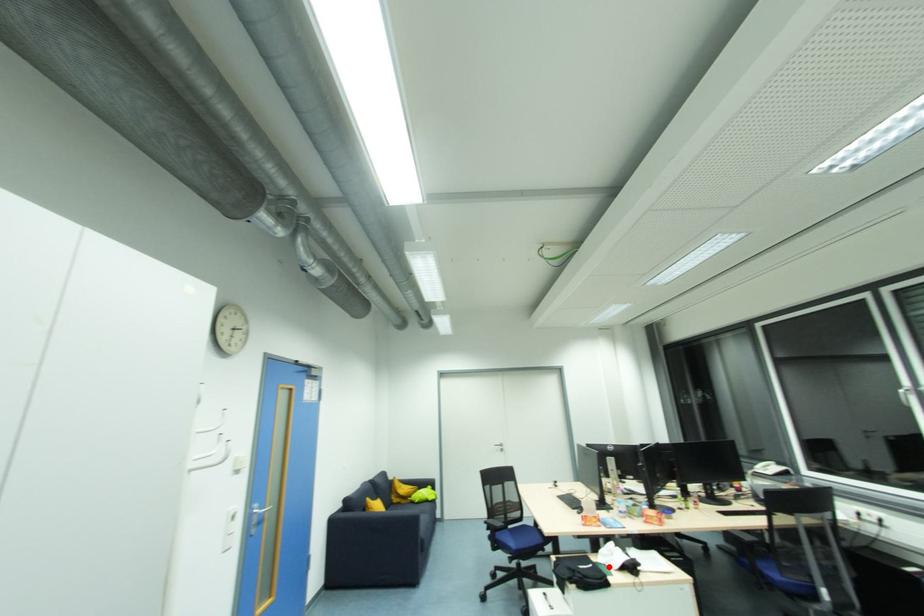
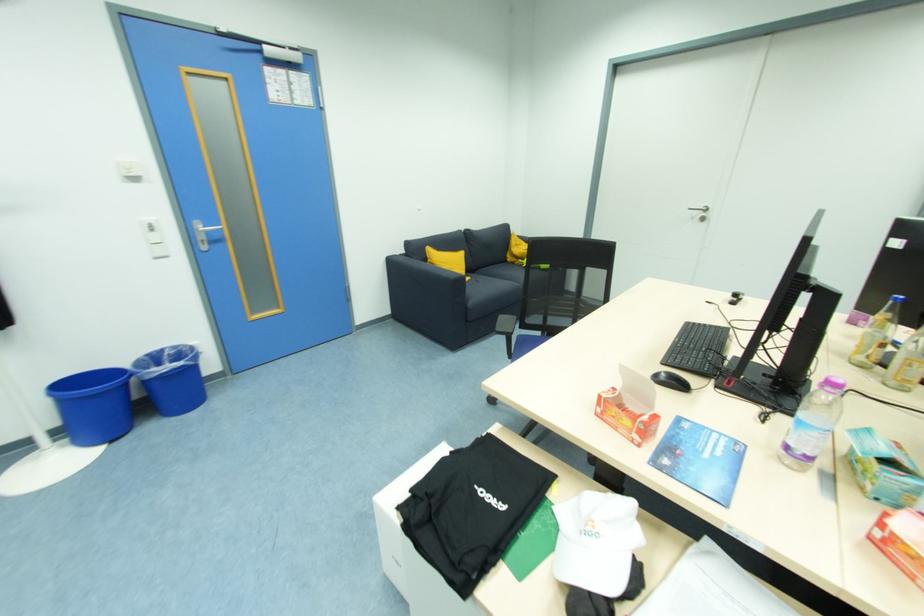
Find the pixel in the second image that matches the highlighted location in the first image.

(563, 535)